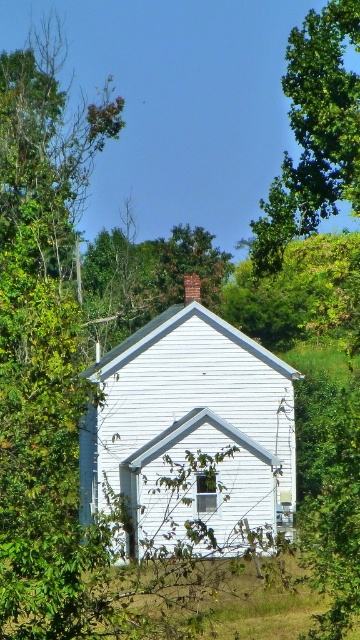
Between green leafy tree at upper center and brick chimney at upper center, which one is positioned higher?

green leafy tree at upper center is higher up.

Who is shorter, green leafy tree at upper center or brick chimney at upper center?

Standing shorter between the two is brick chimney at upper center.

Measure the distance between green leafy tree at upper center and camera.

green leafy tree at upper center is 43.52 meters away from camera.

Find the location of `green leafy tree at upper center`. green leafy tree at upper center is located at coordinates (313, 134).